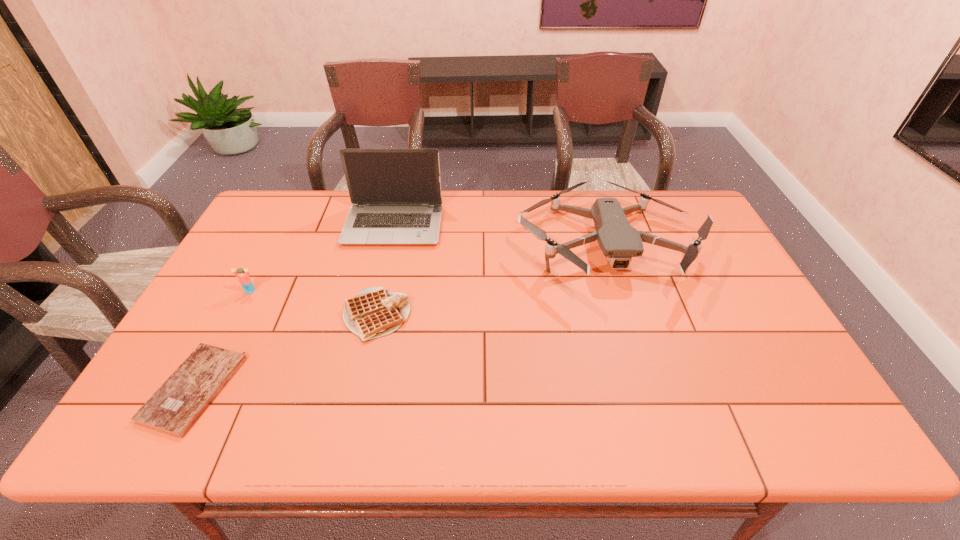
Locate an element on the screen. The height and width of the screenshot is (540, 960). laptop computer is located at coordinates [x=396, y=198].

This screenshot has height=540, width=960. What are the coordinates of `the rightmost object` in the screenshot? It's located at (619, 241).

Find the location of a particular element. drone is located at coordinates (619, 241).

Locate an element on the screen. Image resolution: width=960 pixels, height=540 pixels. Lego is located at coordinates [244, 279].

Where is `waffle`? This screenshot has width=960, height=540. waffle is located at coordinates (375, 312).

Image resolution: width=960 pixels, height=540 pixels. In order to click on the shortest object in this screenshot , I will do `click(175, 407)`.

Find the location of a particular element. The image size is (960, 540). Bible is located at coordinates (175, 407).

The width and height of the screenshot is (960, 540). I want to click on free region located 0.090m on the screen of the laptop computer, so click(x=384, y=268).

Identify the location of blank space located on the front-facing side of the drone. Image resolution: width=960 pixels, height=540 pixels. (640, 347).

At what (x,y) coordinates should I click in order to perform the action: click on free space located on the face of the third tallest object. Please return your answer as a coordinate pair (x, y). The height and width of the screenshot is (540, 960). Looking at the image, I should click on coord(227,336).